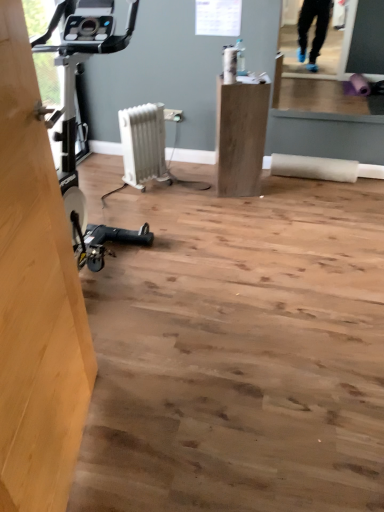
Question: Does light brown wood at left contain white plastic radiator at center?

Choices:
 (A) no
 (B) yes

Answer: (A)

Question: Is the depth of light brown wood at left greater than that of white plastic radiator at center?

Choices:
 (A) no
 (B) yes

Answer: (A)

Question: From a real-world perspective, is light brown wood at left under white plastic radiator at center?

Choices:
 (A) no
 (B) yes

Answer: (A)

Question: Is light brown wood at left outside white plastic radiator at center?

Choices:
 (A) no
 (B) yes

Answer: (B)

Question: Is light brown wood at left looking in the opposite direction of white plastic radiator at center?

Choices:
 (A) yes
 (B) no

Answer: (B)

Question: From the image's perspective, would you say light brown wood at left is positioned over white plastic radiator at center?

Choices:
 (A) yes
 (B) no

Answer: (B)

Question: From a real-world perspective, is white plastic radiator at center located beneath light brown wood at left?

Choices:
 (A) no
 (B) yes

Answer: (B)

Question: Is white plastic radiator at center in contact with light brown wood at left?

Choices:
 (A) no
 (B) yes

Answer: (A)

Question: Can you confirm if white plastic radiator at center is thinner than light brown wood at left?

Choices:
 (A) yes
 (B) no

Answer: (B)

Question: Considering the relative sizes of white plastic radiator at center and light brown wood at left in the image provided, is white plastic radiator at center wider than light brown wood at left?

Choices:
 (A) yes
 (B) no

Answer: (A)

Question: Does white plastic radiator at center appear on the right side of light brown wood at left?

Choices:
 (A) yes
 (B) no

Answer: (A)

Question: Is white plastic radiator at center looking in the opposite direction of light brown wood at left?

Choices:
 (A) yes
 (B) no

Answer: (B)

Question: Is matte wood cabinet at center completely or partially outside of white plastic radiator at center?

Choices:
 (A) no
 (B) yes

Answer: (B)